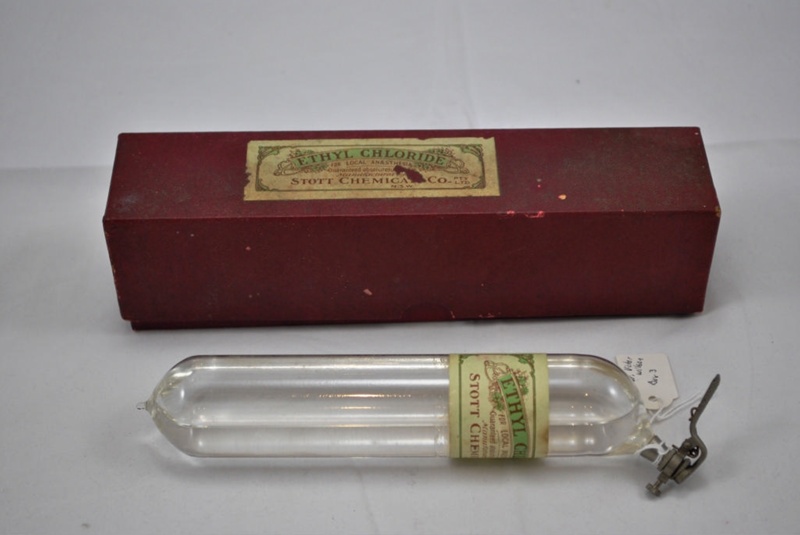
Find the location of a particular element. The height and width of the screenshot is (535, 800). handle to open the lid is located at coordinates tap(708, 394).